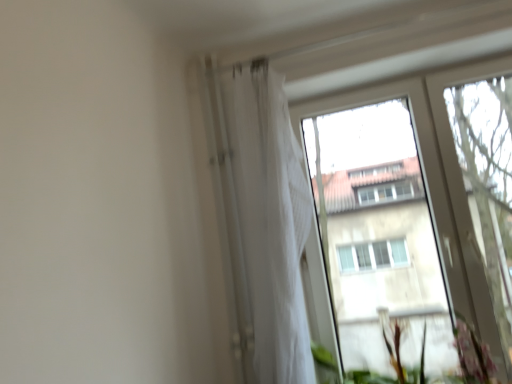
Locate an element on the screen. Image resolution: width=512 pixels, height=384 pixels. transparent glass tree at right is located at coordinates (488, 181).

The height and width of the screenshot is (384, 512). Identify the location of white sheer curtain at upper center. (269, 225).

Image resolution: width=512 pixels, height=384 pixels. I want to click on transparent glass tree at right, so click(488, 181).

Considering the sizes of objects green leafy plant at lower right and white sheer curtain at upper center in the image provided, who is taller, green leafy plant at lower right or white sheer curtain at upper center?

white sheer curtain at upper center.

Between green leafy plant at lower right and white sheer curtain at upper center, which one is positioned in front?

green leafy plant at lower right is closer to the camera.

Where is `vegetation that is below the white sheer curtain at upper center (from the image's perspective)`? The image size is (512, 384). vegetation that is below the white sheer curtain at upper center (from the image's perspective) is located at coordinates (471, 357).

Based on the photo, who is bigger, green leafy plant at lower right or white sheer curtain at upper center?

With larger size is white sheer curtain at upper center.

From the image's perspective, is transparent glass tree at right above white sheer curtain at upper center?

Yes, from the image's perspective, transparent glass tree at right is over white sheer curtain at upper center.

Is transparent glass tree at right facing away from white sheer curtain at upper center?

No, transparent glass tree at right is not facing away from white sheer curtain at upper center.

Which object is closer to the camera, transparent glass tree at right or white sheer curtain at upper center?

Positioned in front is white sheer curtain at upper center.

From a real-world perspective, is transparent glass tree at right physically above white sheer curtain at upper center?

No, from a real-world perspective, transparent glass tree at right is not over white sheer curtain at upper center

Is green leafy plant at lower right with transparent glass tree at right?

green leafy plant at lower right and transparent glass tree at right are clearly separated.

Which is in front, point (365, 378) or point (506, 348)?

The point (506, 348) is closer to the camera.

Is green leafy plant at lower right bigger or smaller than transparent glass tree at right?

Clearly, green leafy plant at lower right is smaller in size than transparent glass tree at right.

From the image's perspective, relative to green leafy plant at lower right, is transparent glass tree at right above or below?

transparent glass tree at right is situated higher than green leafy plant at lower right in the image.

Which is correct: transparent glass tree at right is inside green leafy plant at lower right, or outside of it?

transparent glass tree at right cannot be found inside green leafy plant at lower right.

Is transparent glass tree at right facing towards green leafy plant at lower right?

No, transparent glass tree at right is not aimed at green leafy plant at lower right.

From a real-world perspective, which is physically below, transparent glass tree at right or green leafy plant at lower right?

In real-world perspective, green leafy plant at lower right is lower.

I want to click on vegetation on the right of the white sheer curtain at upper center, so click(x=471, y=357).

Which object is wider, white sheer curtain at upper center or green leafy plant at lower right?

green leafy plant at lower right.

Is white sheer curtain at upper center situated inside green leafy plant at lower right or outside?

white sheer curtain at upper center is outside green leafy plant at lower right.

Based on the photo, from a real-world perspective, which object stands above the other?

white sheer curtain at upper center.

Considering the sizes of objects white sheer curtain at upper center and transparent glass tree at right in the image provided, who is bigger, white sheer curtain at upper center or transparent glass tree at right?

Bigger between the two is white sheer curtain at upper center.

From their relative heights in the image, would you say white sheer curtain at upper center is taller or shorter than transparent glass tree at right?

Clearly, white sheer curtain at upper center is shorter compared to transparent glass tree at right.

Is white sheer curtain at upper center far away from transparent glass tree at right?

No, there isn't a large distance between white sheer curtain at upper center and transparent glass tree at right.

Locate an element on the screen. The width and height of the screenshot is (512, 384). vegetation that is in front of the white sheer curtain at upper center is located at coordinates (471, 357).

You are a GUI agent. You are given a task and a screenshot of the screen. Output one action in this format:
    pyautogui.click(x=<x>, y=<y>)
    Task: Click on the tree that appears below the white sheer curtain at upper center (from a real-world perspective)
    
    Given the screenshot: What is the action you would take?
    pyautogui.click(x=488, y=181)

Looking at the image, which one is located closer to green leafy plant at lower right, white sheer curtain at upper center or transparent glass tree at right?

transparent glass tree at right.

From the image, which object appears to be nearer to white sheer curtain at upper center, green leafy plant at lower right or transparent glass tree at right?

green leafy plant at lower right is positioned closer to the anchor white sheer curtain at upper center.

From the image, which object appears to be nearer to green leafy plant at lower right, transparent glass tree at right or white sheer curtain at upper center?

transparent glass tree at right is positioned closer to the anchor green leafy plant at lower right.

Which object lies further to the anchor point transparent glass tree at right, white sheer curtain at upper center or green leafy plant at lower right?

white sheer curtain at upper center is positioned further to the anchor transparent glass tree at right.

Considering their positions, is transparent glass tree at right positioned closer to white sheer curtain at upper center than green leafy plant at lower right?

green leafy plant at lower right is closer to white sheer curtain at upper center.

Considering their positions, is green leafy plant at lower right positioned further to transparent glass tree at right than white sheer curtain at upper center?

white sheer curtain at upper center is further to transparent glass tree at right.

Where is `vegetation between white sheer curtain at upper center and transparent glass tree at right`? The height and width of the screenshot is (384, 512). vegetation between white sheer curtain at upper center and transparent glass tree at right is located at coordinates (471, 357).